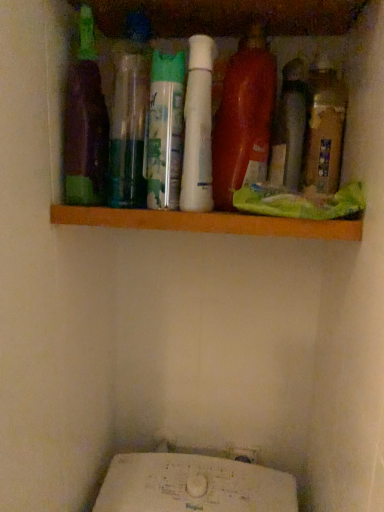
Question: From a real-world perspective, is brown matte bottle at right, which is counted as the 1th bottle, starting from the right, over green matte spray can at center, the fifth bottle in the right-to-left sequence?

Choices:
 (A) yes
 (B) no

Answer: (A)

Question: Considering the relative sizes of brown matte bottle at right, which is counted as the 1th bottle, starting from the right, and green matte spray can at center, the fifth bottle in the right-to-left sequence, in the image provided, is brown matte bottle at right, which is counted as the 1th bottle, starting from the right, bigger than green matte spray can at center, the fifth bottle in the right-to-left sequence,?

Choices:
 (A) no
 (B) yes

Answer: (A)

Question: Does brown matte bottle at right, which is counted as the 1th bottle, starting from the right, have a lesser height compared to green matte spray can at center, the fifth bottle in the right-to-left sequence?

Choices:
 (A) no
 (B) yes

Answer: (A)

Question: Is brown matte bottle at right, which ranks as the 7th bottle in left-to-right order, positioned before green matte spray can at center, which ranks as the third bottle in left-to-right order?

Choices:
 (A) no
 (B) yes

Answer: (A)

Question: Is green matte spray can at center, the fifth bottle in the right-to-left sequence, completely or partially inside brown matte bottle at right, which ranks as the 7th bottle in left-to-right order?

Choices:
 (A) no
 (B) yes

Answer: (A)

Question: Based on their sizes in the image, would you say brown matte bottle at right, which ranks as the 7th bottle in left-to-right order, is bigger or smaller than green matte spray can at center, the fifth bottle in the right-to-left sequence?

Choices:
 (A) big
 (B) small

Answer: (B)

Question: Looking at their shapes, would you say brown matte bottle at right, which ranks as the 7th bottle in left-to-right order, is wider or thinner than green matte spray can at center, which ranks as the third bottle in left-to-right order?

Choices:
 (A) thin
 (B) wide

Answer: (A)

Question: Is brown matte bottle at right, which is counted as the 1th bottle, starting from the right, to the left or to the right of green matte spray can at center, the fifth bottle in the right-to-left sequence, in the image?

Choices:
 (A) right
 (B) left

Answer: (A)

Question: From the image's perspective, relative to green matte spray can at center, the fifth bottle in the right-to-left sequence, is brown matte bottle at right, which is counted as the 1th bottle, starting from the right, above or below?

Choices:
 (A) below
 (B) above

Answer: (B)

Question: Relative to purple matte bottle at left, the 1th bottle when ordered from left to right, is green matte spray can at center, positioned as the 2th bottle in left-to-right order, in front or behind?

Choices:
 (A) front
 (B) behind

Answer: (A)

Question: Considering the positions of green matte spray can at center, the sixth bottle in the right-to-left sequence, and purple matte bottle at left, which is the seventh bottle from right to left, in the image, is green matte spray can at center, the sixth bottle in the right-to-left sequence, taller or shorter than purple matte bottle at left, which is the seventh bottle from right to left,?

Choices:
 (A) short
 (B) tall

Answer: (B)

Question: From the image's perspective, is green matte spray can at center, positioned as the 2th bottle in left-to-right order, positioned above or below purple matte bottle at left, which is the seventh bottle from right to left?

Choices:
 (A) below
 (B) above

Answer: (B)

Question: From a real-world perspective, relative to purple matte bottle at left, which is the seventh bottle from right to left, is green matte spray can at center, the sixth bottle in the right-to-left sequence, vertically above or below?

Choices:
 (A) below
 (B) above

Answer: (B)

Question: From a real-world perspective, is brown matte bottle at right, which is counted as the 1th bottle, starting from the right, above or below purple matte bottle at left, the 1th bottle when ordered from left to right?

Choices:
 (A) above
 (B) below

Answer: (B)

Question: Would you say brown matte bottle at right, which is counted as the 1th bottle, starting from the right, is to the left or to the right of purple matte bottle at left, the 1th bottle when ordered from left to right, in the picture?

Choices:
 (A) left
 (B) right

Answer: (B)